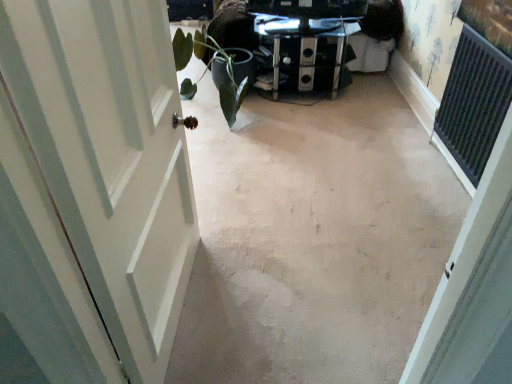
Measure the distance between green matte plant at left and camera.

green matte plant at left and camera are 9.62 feet apart from each other.

The image size is (512, 384). What are the coordinates of `white painted wood door at left` in the screenshot? It's located at (111, 156).

From a real-world perspective, is metallic glass table at center above or below beige carpet at center?

Clearly, from a real-world perspective, metallic glass table at center is above beige carpet at center.

Can you confirm if metallic glass table at center is positioned to the right of beige carpet at center?

Yes.

How distant is metallic glass table at center from beige carpet at center?

metallic glass table at center is 1.16 meters from beige carpet at center.

Between green matte plant at left and metallic glass table at center, which one has smaller size?

metallic glass table at center is smaller.

Considering the positions of objects green matte plant at left and metallic glass table at center in the image provided, who is behind, green matte plant at left or metallic glass table at center?

metallic glass table at center is further away from the camera.

Which of these two, green matte plant at left or metallic glass table at center, stands taller?

green matte plant at left.

Considering the positions of point (184, 54) and point (184, 262), is point (184, 54) closer or farther from the camera than point (184, 262)?

Clearly, point (184, 54) is more distant from the camera than point (184, 262).

Which of these two, green matte plant at left or white painted wood door at left, is bigger?

Answer: green matte plant at left is bigger.

Is green matte plant at left touching white painted wood door at left?

There is a gap between green matte plant at left and white painted wood door at left.

Is green matte plant at left facing away from white painted wood door at left?

No, white painted wood door at left is not at the back of green matte plant at left.

From a real-world perspective, relative to white painted wood door at left, is beige carpet at center vertically above or below?

beige carpet at center is below white painted wood door at left.

Considering the positions of objects beige carpet at center and white painted wood door at left in the image provided, who is more to the left, beige carpet at center or white painted wood door at left?

Positioned to the left is white painted wood door at left.

From the image's perspective, is beige carpet at center on white painted wood door at left?

Correct, beige carpet at center appears higher than white painted wood door at left in the image.

From the image's perspective, is white painted wood door at left located above or below metallic glass table at center?

Based on their image positions, white painted wood door at left is located beneath metallic glass table at center.

Which object is more forward, white painted wood door at left or metallic glass table at center?

white painted wood door at left is in front.

Could you tell me if white painted wood door at left is facing metallic glass table at center?

No, white painted wood door at left does not turn towards metallic glass table at center.

Where is `door located below the metallic glass table at center (from the image's perspective)`? The width and height of the screenshot is (512, 384). door located below the metallic glass table at center (from the image's perspective) is located at coordinates pyautogui.click(x=111, y=156).

From the picture: From the image's perspective, which is above, beige carpet at center or green matte plant at left?

green matte plant at left, from the image's perspective.

From their relative heights in the image, would you say beige carpet at center is taller or shorter than green matte plant at left?

In the image, beige carpet at center appears to be shorter than green matte plant at left.

Does point (314, 193) come farther from viewer compared to point (243, 54)?

That is False.

The width and height of the screenshot is (512, 384). I want to click on plant that appears on the left of beige carpet at center, so click(x=210, y=65).

Between metallic glass table at center and green matte plant at left, which one has less height?

metallic glass table at center is shorter.

Is metallic glass table at center closer to the viewer compared to green matte plant at left?

No, metallic glass table at center is further to the viewer.

Where is `furniture that appears on the right of green matte plant at left`? furniture that appears on the right of green matte plant at left is located at coordinates (307, 51).

Consider the image. Would you say metallic glass table at center is inside or outside green matte plant at left?

metallic glass table at center lies outside green matte plant at left.

Identify the location of furniture lying behind the beige carpet at center. The width and height of the screenshot is (512, 384). (307, 51).

The image size is (512, 384). What are the coordinates of `plant that appears in front of the metallic glass table at center` in the screenshot? It's located at (210, 65).

Estimate the real-world distances between objects in this image. Which object is further from beige carpet at center, green matte plant at left or white painted wood door at left?

green matte plant at left is further to beige carpet at center.

From the image, which object appears to be nearer to green matte plant at left, white painted wood door at left or beige carpet at center?

beige carpet at center is positioned closer to the anchor green matte plant at left.

When comparing their distances from metallic glass table at center, does green matte plant at left or beige carpet at center seem further?

Based on the image, beige carpet at center appears to be further to metallic glass table at center.

Considering their positions, is white painted wood door at left positioned closer to metallic glass table at center than beige carpet at center?

beige carpet at center lies closer to metallic glass table at center than the other object.

Which object lies further to the anchor point green matte plant at left, metallic glass table at center or beige carpet at center?

beige carpet at center lies further to green matte plant at left than the other object.

Considering their positions, is beige carpet at center positioned further to metallic glass table at center than green matte plant at left?

The object further to metallic glass table at center is beige carpet at center.

Considering their positions, is metallic glass table at center positioned further to green matte plant at left than white painted wood door at left?

white painted wood door at left is further to green matte plant at left.

From the image, which object appears to be nearer to green matte plant at left, beige carpet at center or white painted wood door at left?

beige carpet at center is closer to green matte plant at left.

Where is `plant positioned between white painted wood door at left and metallic glass table at center from near to far`? plant positioned between white painted wood door at left and metallic glass table at center from near to far is located at coordinates (210, 65).

Locate an element on the screen. concrete located between white painted wood door at left and green matte plant at left in the depth direction is located at coordinates (313, 239).

Locate an element on the screen. Image resolution: width=512 pixels, height=384 pixels. concrete between white painted wood door at left and metallic glass table at center along the z-axis is located at coordinates (313, 239).

Locate an element on the screen. Image resolution: width=512 pixels, height=384 pixels. plant located between beige carpet at center and metallic glass table at center in the depth direction is located at coordinates [x=210, y=65].